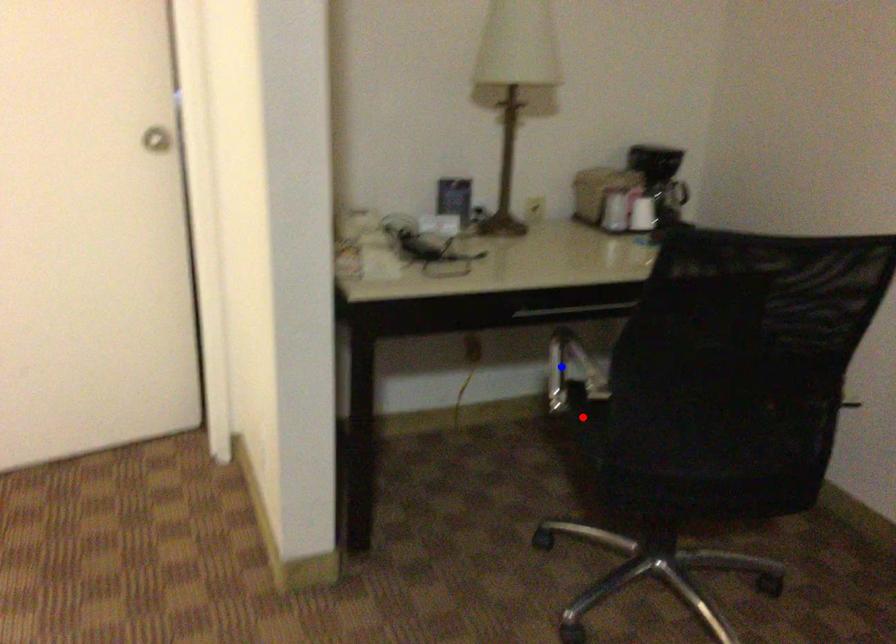
Question: Two points are marked on the image. Which point is closer to the camera?

Choices:
 (A) Blue point is closer.
 (B) Red point is closer.

Answer: (B)